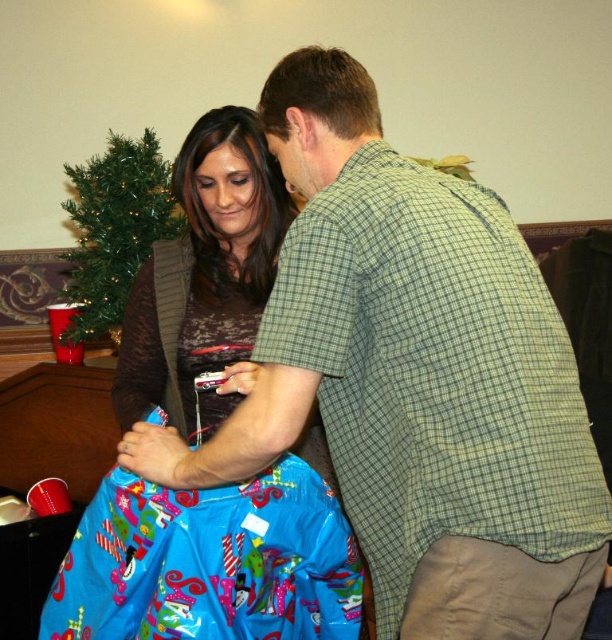
Question: Can you confirm if matte brown sweater at center is positioned to the right of green artificial christmas tree at upper left?

Choices:
 (A) no
 (B) yes

Answer: (B)

Question: Can you confirm if matte brown sweater at center is bigger than green artificial christmas tree at upper left?

Choices:
 (A) yes
 (B) no

Answer: (A)

Question: Which point is closer to the camera?

Choices:
 (A) matte brown sweater at center
 (B) green artificial christmas tree at upper left

Answer: (A)

Question: Which of the following is the closest to the observer?

Choices:
 (A) green artificial christmas tree at upper left
 (B) matte brown sweater at center

Answer: (B)

Question: Is matte brown sweater at center closer to camera compared to green artificial christmas tree at upper left?

Choices:
 (A) no
 (B) yes

Answer: (B)